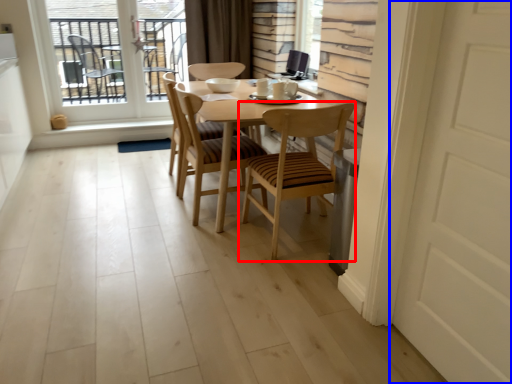
Question: Which point is closer to the camera, chair (highlighted by a red box) or door (highlighted by a blue box)?

Choices:
 (A) chair
 (B) door

Answer: (B)